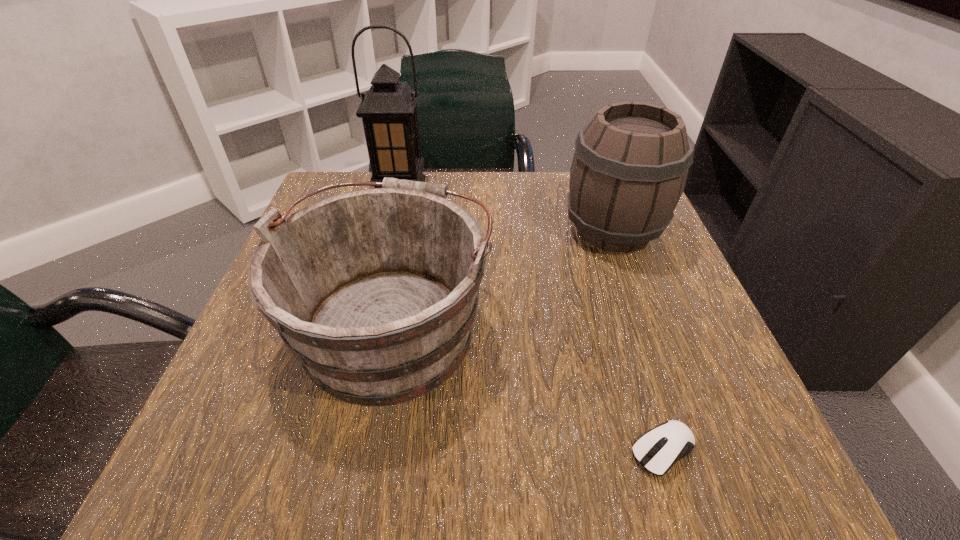
Locate an element on the screen. This screenshot has width=960, height=540. free space between the right wine bucket and the left wine bucket is located at coordinates (503, 277).

Locate an element on the screen. free area in between the right wine bucket and the left wine bucket is located at coordinates (503, 277).

Where is `vacant area between the second tallest object and the lantern`? The height and width of the screenshot is (540, 960). vacant area between the second tallest object and the lantern is located at coordinates (507, 208).

What are the coordinates of `vacant area between the mouse and the left wine bucket` in the screenshot? It's located at (528, 387).

Locate an element on the screen. empty space between the tallest object and the mouse is located at coordinates (532, 319).

Where is `unoccupied position between the nearest object and the tallest object`? The height and width of the screenshot is (540, 960). unoccupied position between the nearest object and the tallest object is located at coordinates (532, 319).

The width and height of the screenshot is (960, 540). Identify the location of free space that is in between the shortest object and the shorter wine bucket. (x=528, y=387).

Image resolution: width=960 pixels, height=540 pixels. I want to click on object identified as the closest to the nearest object, so click(375, 291).

Select which object appears as the third closest to the shortest object. Please provide its 2D coordinates. Your answer should be formatted as a tuple, i.e. [(x, y)], where the tuple contains the x and y coordinates of a point satisfying the conditions above.

[(388, 110)]

Where is `free location that satisfies the following two spatial constraints: 1. on the front side of the nearest object; 2. on the left side of the farthest object`? This screenshot has height=540, width=960. free location that satisfies the following two spatial constraints: 1. on the front side of the nearest object; 2. on the left side of the farthest object is located at coordinates (335, 450).